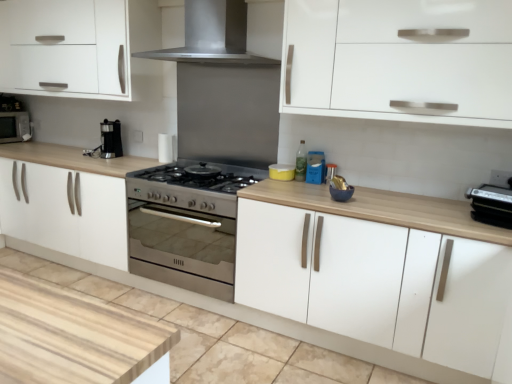
Find the location of a particular element. vacant area in front of yellow matte container at center, marked as the 1th appliance in a left-to-right arrangement is located at coordinates (287, 186).